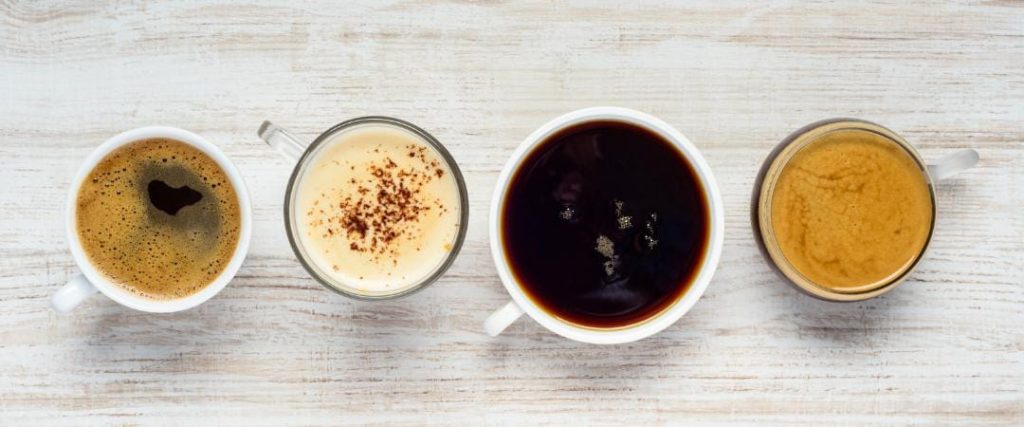
I want to click on rim of cup, so click(x=224, y=163), click(x=372, y=119), click(x=614, y=111), click(x=838, y=123).